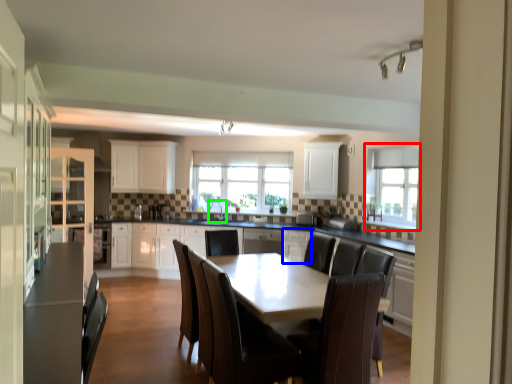
Question: Estimate the real-world distances between objects in this image. Which object is closer to window (highlighted by a red box), cabinetry (highlighted by a blue box) or sink (highlighted by a green box)?

Choices:
 (A) cabinetry
 (B) sink

Answer: (A)